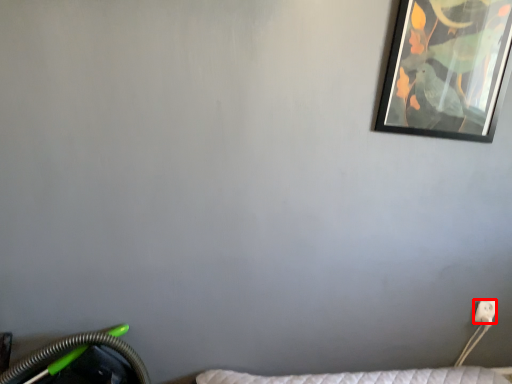
Question: From the image's perspective, what is the correct spatial relationship of electric outlet (annotated by the red box) in relation to picture frame?

Choices:
 (A) below
 (B) above

Answer: (A)